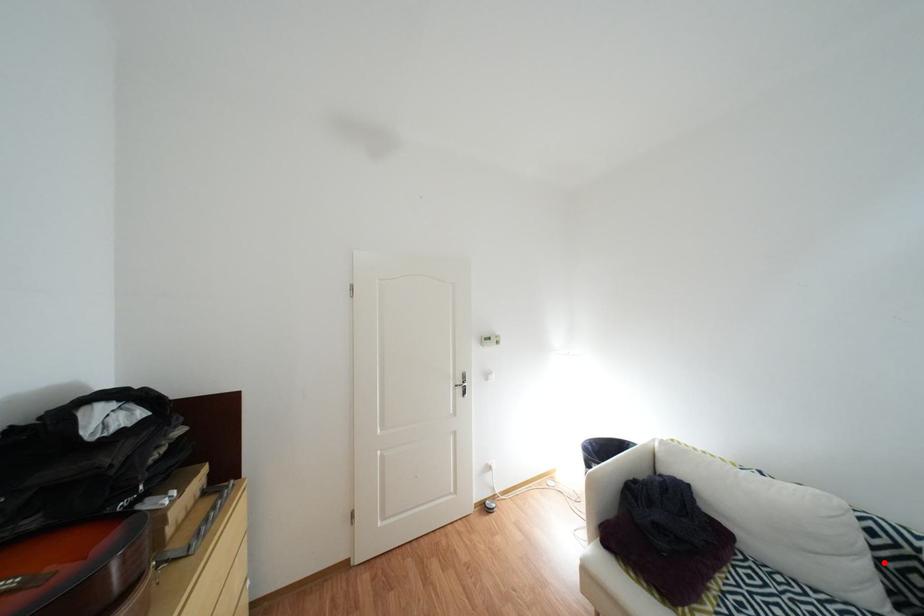
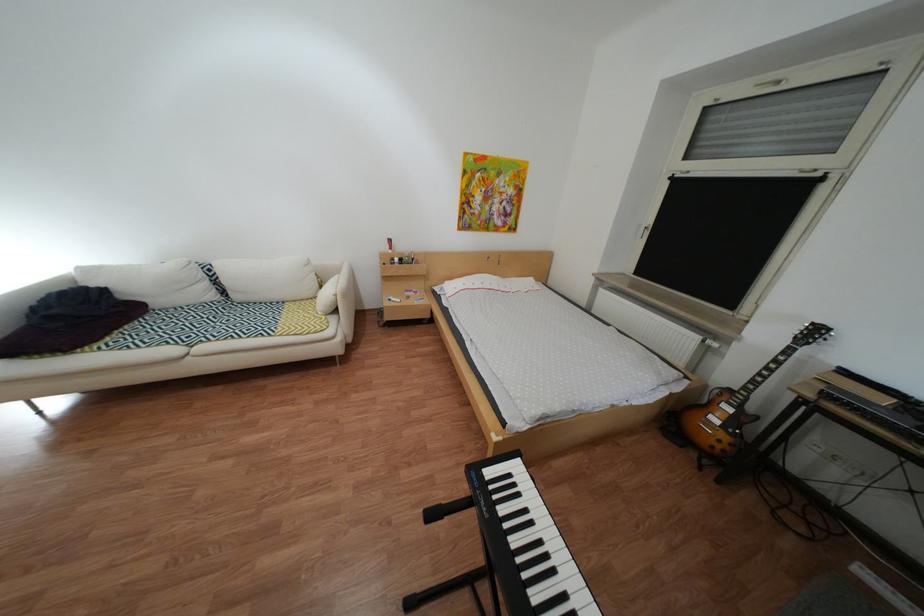
Question: A red point is marked in image1. In image2, is the corresponding 3D point closer to the camera or farther? Reply with the corresponding letter.

Choices:
 (A) The corresponding 3D point is closer.
 (B) The corresponding 3D point is farther.

Answer: (B)